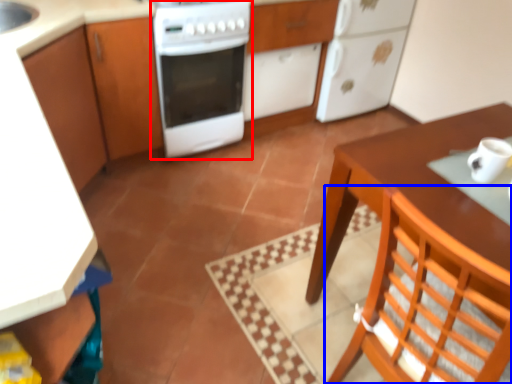
Question: Which of the following is the closest to the observer, home appliance (highlighted by a red box) or chair (highlighted by a blue box)?

Choices:
 (A) home appliance
 (B) chair

Answer: (B)